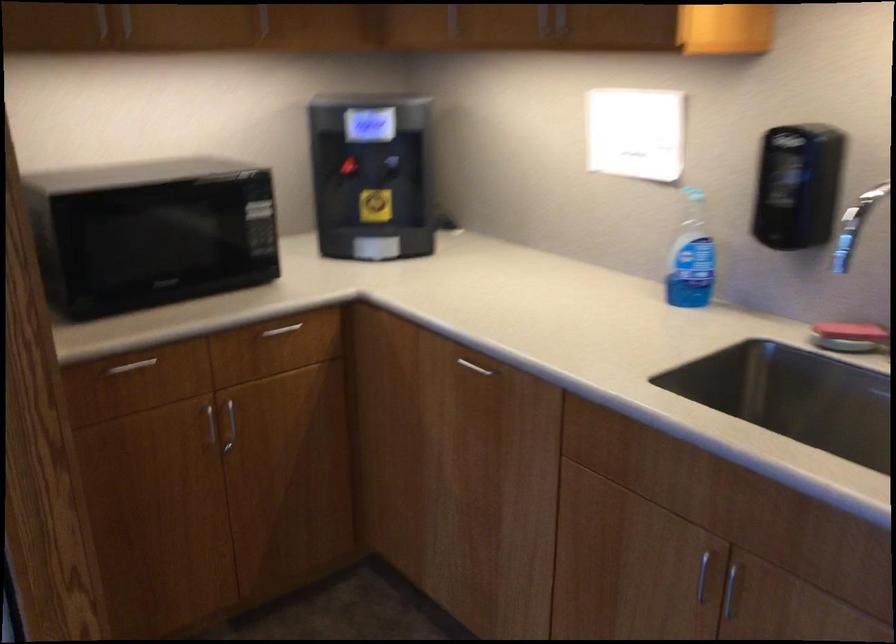
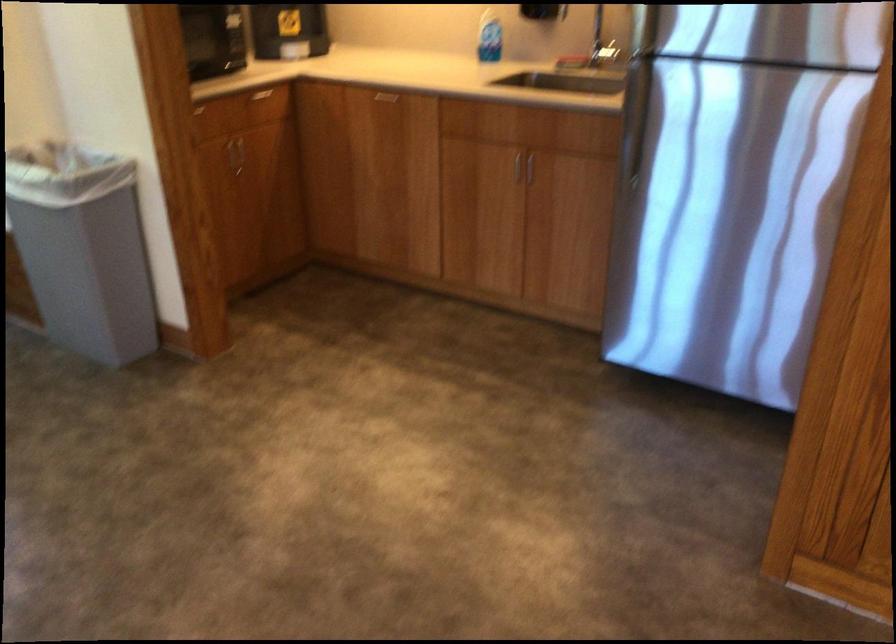
Find the pixel in the second image that matches pixel 685 265 in the first image.

(488, 37)